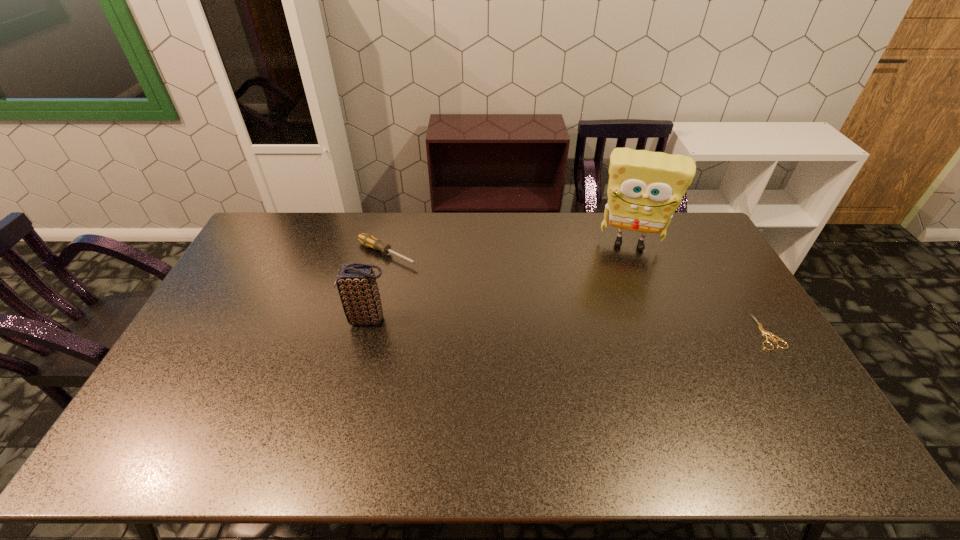
The width and height of the screenshot is (960, 540). Identify the location of vacant space located at the tip of the third tallest object. (441, 275).

Identify the location of vacant region located at the tip of the third tallest object. (495, 301).

You are a GUI agent. You are given a task and a screenshot of the screen. Output one action in this format:
    pyautogui.click(x=<x>, y=<y>)
    Task: Click on the vacant space located 0.380m at the tip of the third tallest object
    Image resolution: width=960 pixels, height=540 pixels.
    Given the screenshot: What is the action you would take?
    pyautogui.click(x=506, y=306)

You are a GUI agent. You are given a task and a screenshot of the screen. Output one action in this format:
    pyautogui.click(x=<x>, y=<y>)
    Task: Click on the vacant position located 0.400m on the face of the second object from right to left
    The width and height of the screenshot is (960, 540).
    Given the screenshot: What is the action you would take?
    pyautogui.click(x=617, y=342)

At what (x,y) coordinates should I click in order to perform the action: click on free spot located 0.290m on the face of the second object from right to left. Please return your answer as a coordinate pair (x, y). The width and height of the screenshot is (960, 540). Looking at the image, I should click on (619, 315).

Locate an element on the screen. free location located 0.350m on the face of the second object from right to left is located at coordinates (618, 329).

You are a GUI agent. You are given a task and a screenshot of the screen. Output one action in this format:
    pyautogui.click(x=<x>, y=<y>)
    Task: Click on the screwdriver located in the far edge section of the desktop
    
    Given the screenshot: What is the action you would take?
    pyautogui.click(x=368, y=240)

Identify the location of sponge located in the far edge section of the desktop. (645, 188).

Image resolution: width=960 pixels, height=540 pixels. I want to click on object located in the right edge section of the desktop, so click(x=764, y=332).

Where is `vacant space at the far edge of the desktop`? vacant space at the far edge of the desktop is located at coordinates (609, 219).